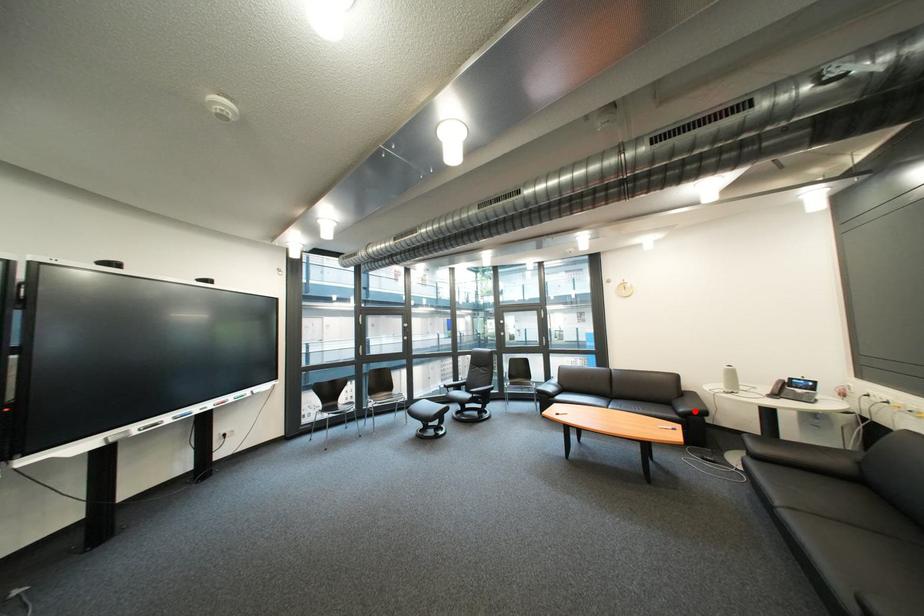
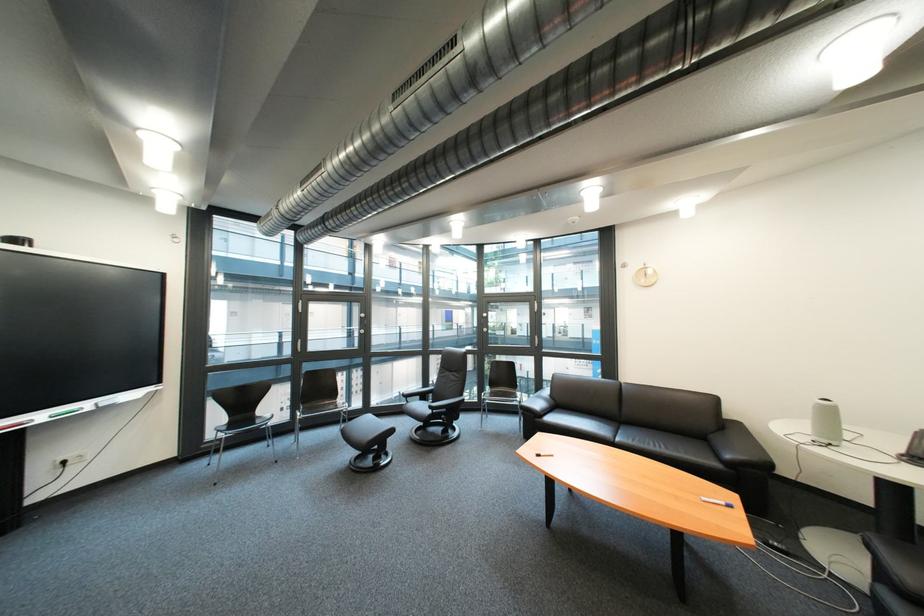
Where in the second image is the point corresponding to the highlighted location from the first image?

(742, 458)